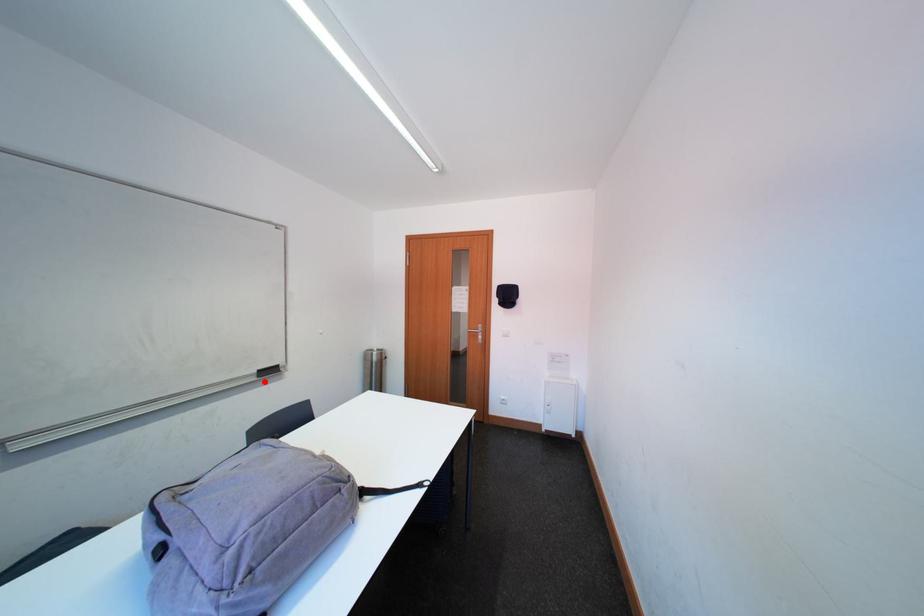
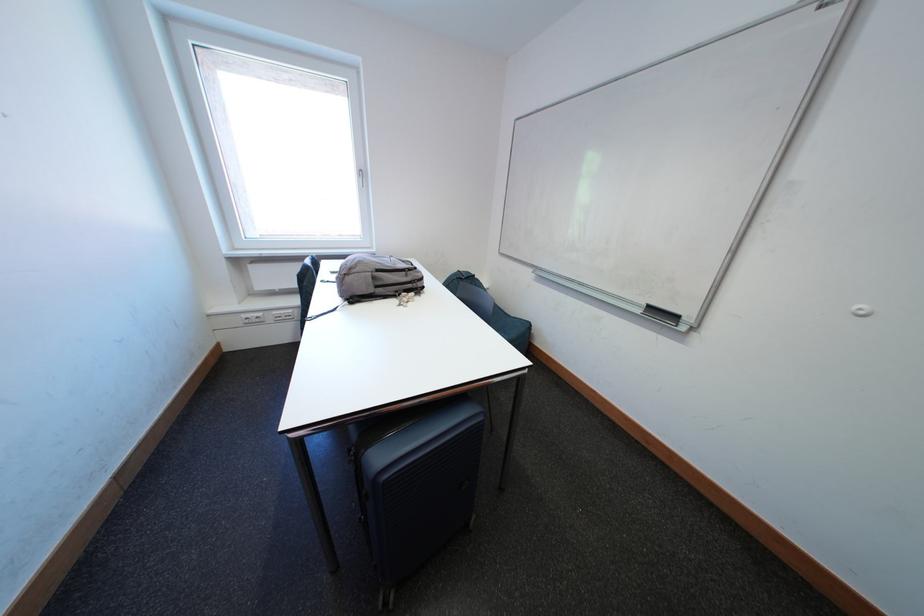
Where in the second image is the point corresponding to the highlighted location from the first image?

(649, 315)